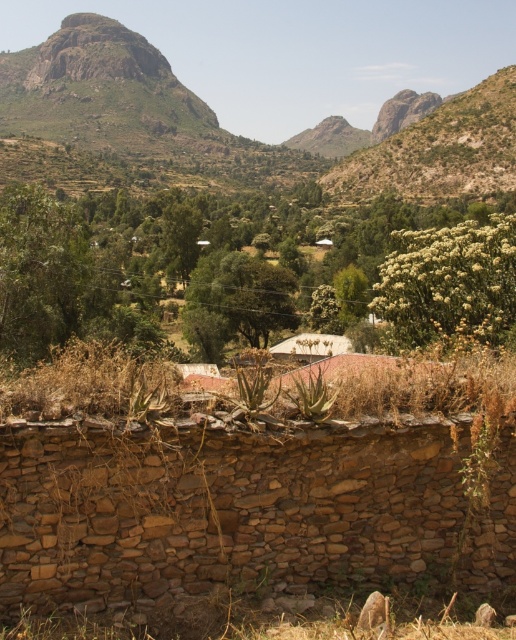
Question: Is green leafy bush at center thinner than white corrugated metal hut at center?

Choices:
 (A) yes
 (B) no

Answer: (B)

Question: Is green leafy bush at center further to the viewer compared to white corrugated metal hut at center?

Choices:
 (A) yes
 (B) no

Answer: (B)

Question: Does green leafy bush at center have a larger size compared to white corrugated metal hut at center?

Choices:
 (A) yes
 (B) no

Answer: (A)

Question: Which object is farther from the camera taking this photo?

Choices:
 (A) green leafy bush at center
 (B) white corrugated metal hut at center

Answer: (B)

Question: Among these points, which one is farthest from the camera?

Choices:
 (A) (331, 280)
 (B) (311, 362)

Answer: (A)

Question: Which point is farther from the camera taking this photo?

Choices:
 (A) coord(25,232)
 (B) coord(302,358)

Answer: (B)